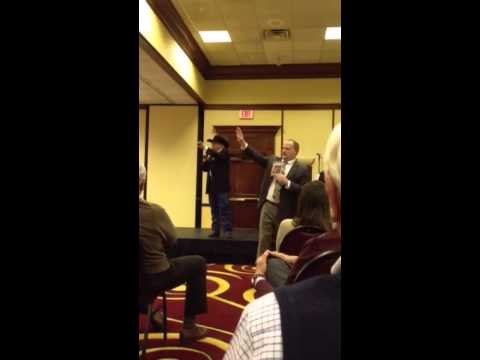
The height and width of the screenshot is (360, 480). Find the location of `ceiling`. ceiling is located at coordinates (254, 5).